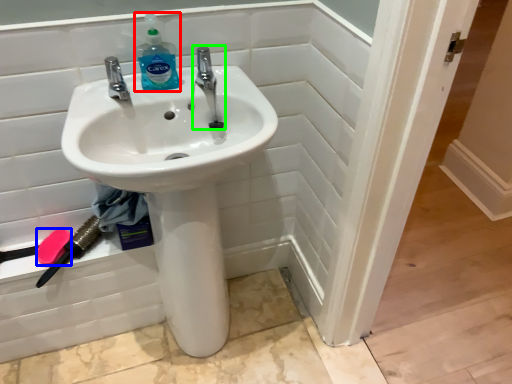
Question: Which object is positioned farthest from cleaning product (highlighted by a red box)? Select from soap (highlighted by a blue box) and tap (highlighted by a green box).

Choices:
 (A) soap
 (B) tap

Answer: (A)